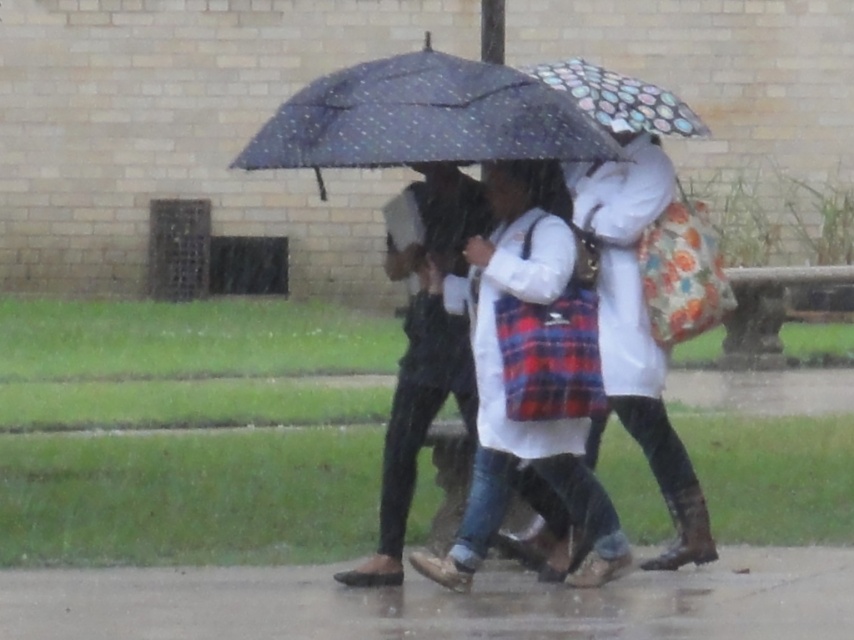
You are standing at the point labeled as point (67, 602) in the image. You want to walk to the nearest building entrance, which is 10 meters away from your current position. Can you reach the entrance without exceeding the 10 meter limit?

The distance between point (67, 602) and the viewer is 9.62 meters. Since the entrance is 10 meters away, you can reach it within the limit.

You are standing on the damp concrete pavement at lower center. What are the coordinates of the point you are standing on?

The coordinates of the damp concrete pavement at lower center are at point (439,602).

You are a delivery person trying to avoid stepping on the damp concrete pavement at lower center while carrying a heavy package. Can you walk around the polka dot fabric umbrella at upper center to stay dry?

The damp concrete pavement at lower center is bigger than the polka dot fabric umbrella at upper center, so you can walk around the polka dot fabric umbrella at upper center to stay dry.